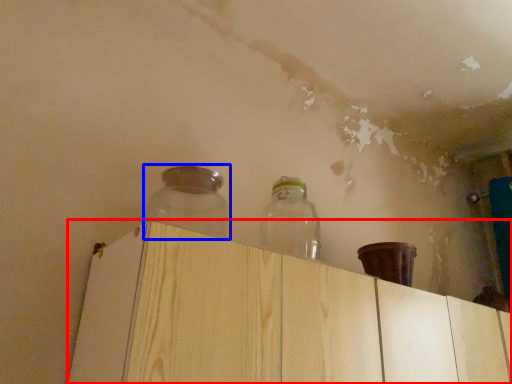
Question: Which point is further to the camera, dresser (highlighted by a red box) or bottle (highlighted by a blue box)?

Choices:
 (A) dresser
 (B) bottle

Answer: (B)